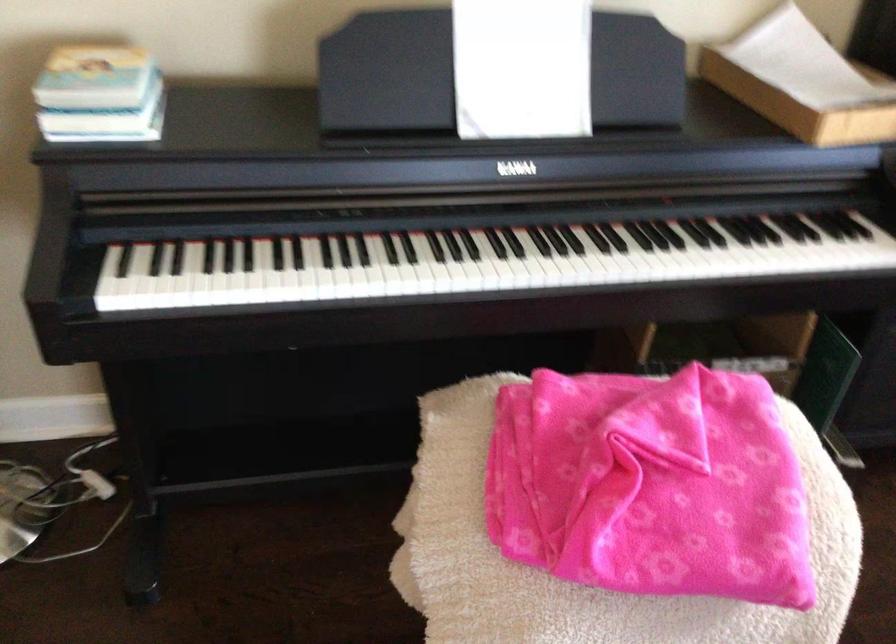
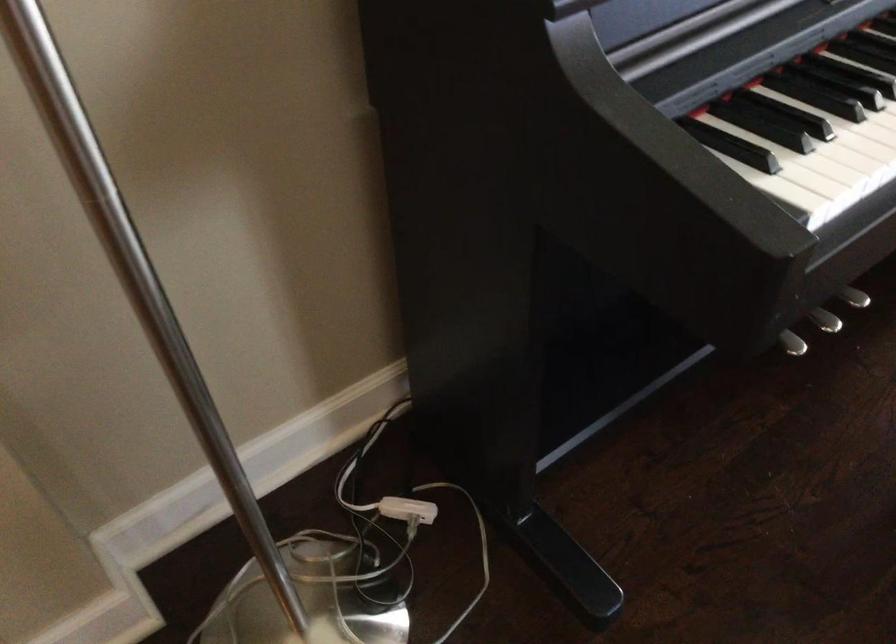
In the second image, find the point that corresponds to point (82, 484) in the first image.

(408, 509)